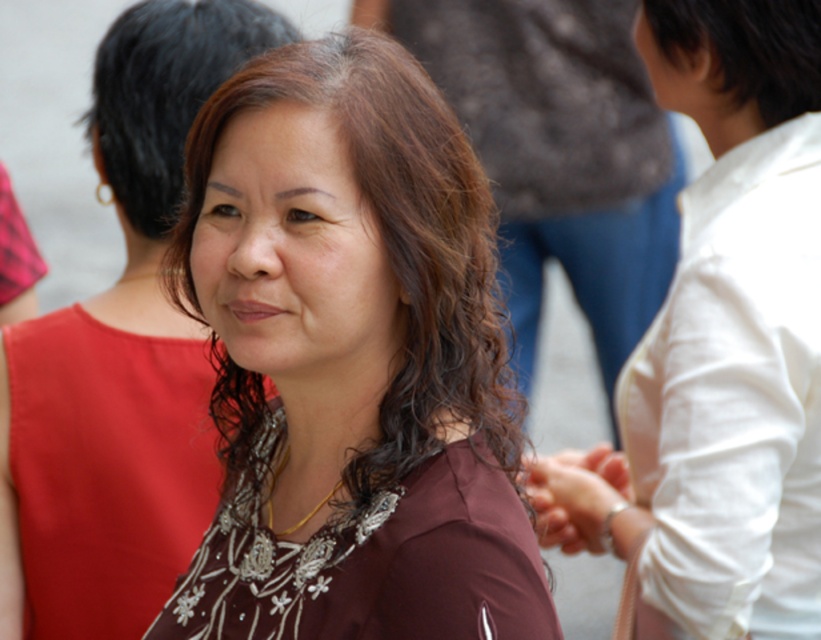
Looking at the scene described, which dress is positioned to the left when comparing the satin red dress at center and the beaded fabric dress at center?

The satin red dress at center is positioned to the left of the beaded fabric dress at center.

From the picture: You are a photographer at a fashion show and need to decide which dress to focus on. The scene has a satin red dress at center and a beaded fabric dress at center. Which dress is smaller in size?

The satin red dress at center is smaller than the beaded fabric dress at center, so the photographer should focus on the satin red dress at center if they want to capture the smaller one.

You are a photographer at a social event. You notice the beaded fabric dress at center and the dark brown hair at upper right in your viewfinder. Which object is located more to the left side of the frame?

The beaded fabric dress at center is positioned on the left side of dark brown hair at upper right, so it is more to the left in the frame.